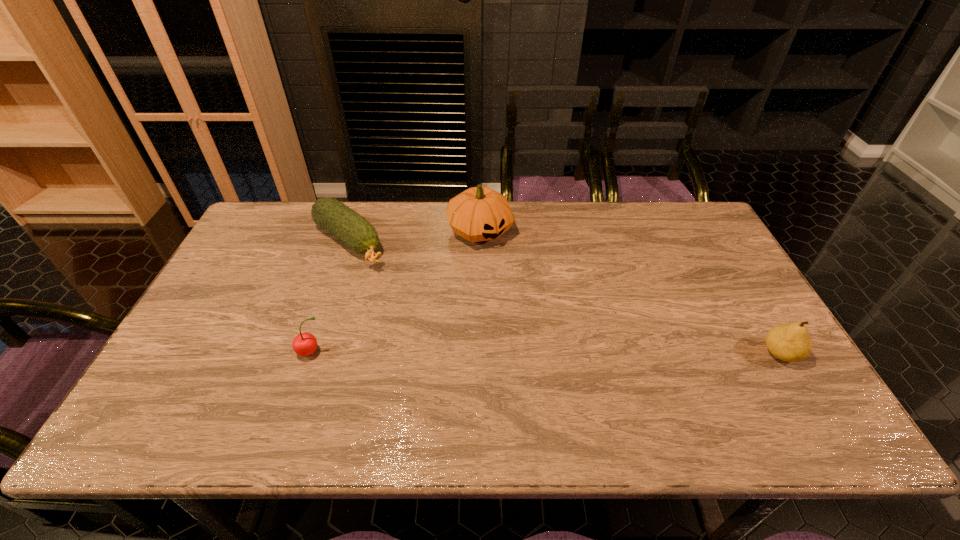
I want to click on free area in between the cherry and the second object from right to left, so click(x=396, y=292).

Find the location of a particular element. free space between the shortest object and the tallest object is located at coordinates (414, 237).

Find the location of `unoccupied position between the pear and the cherry`. unoccupied position between the pear and the cherry is located at coordinates (546, 353).

Image resolution: width=960 pixels, height=540 pixels. Identify the location of the closest object to the cherry. (354, 230).

Identify the location of the closest object to the third object from left to right. (354, 230).

Where is `vacant region that satisfies the following two spatial constraints: 1. on the back side of the tallest object; 2. on the right side of the cherry`? vacant region that satisfies the following two spatial constraints: 1. on the back side of the tallest object; 2. on the right side of the cherry is located at coordinates (352, 231).

Identify the location of free point that satisfies the following two spatial constraints: 1. on the back side of the third object from left to right; 2. on the right side of the cherry. Image resolution: width=960 pixels, height=540 pixels. (352, 231).